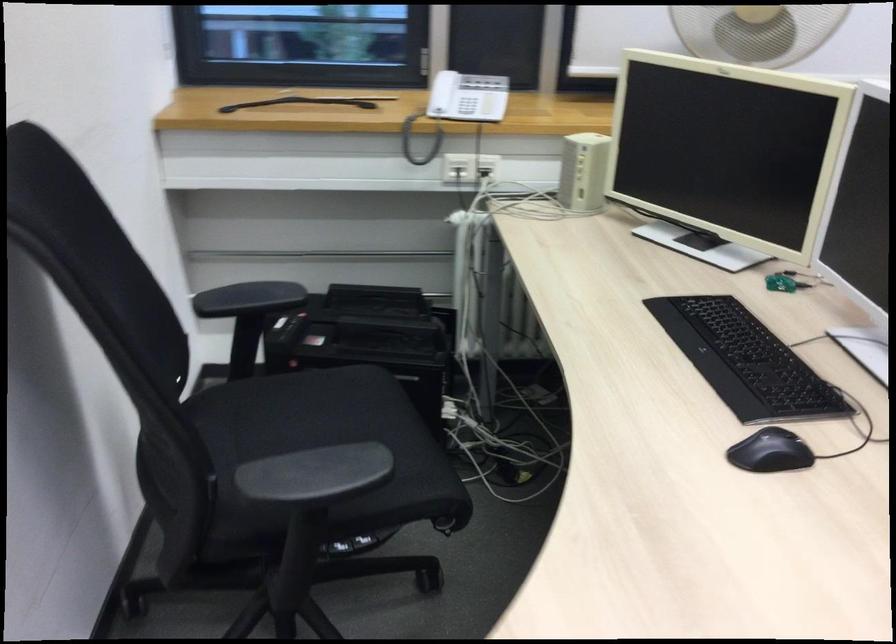
Which object does [745,361] point to?

This point indicates the black computer keyboard.